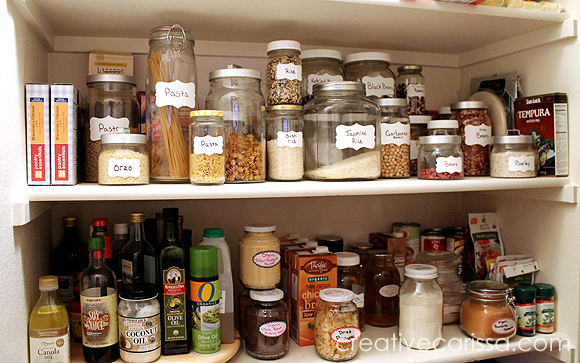
You are a GUI agent. You are given a task and a screenshot of the screen. Output one action in this format:
    pyautogui.click(x=<x>, y=<y>)
    Task: Click on the jars on the bottom shelf
    
    Given the screenshot: What is the action you would take?
    pyautogui.click(x=250, y=262), pyautogui.click(x=261, y=325), pyautogui.click(x=345, y=315), pyautogui.click(x=349, y=275), pyautogui.click(x=389, y=285), pyautogui.click(x=419, y=302), pyautogui.click(x=449, y=284), pyautogui.click(x=489, y=314)